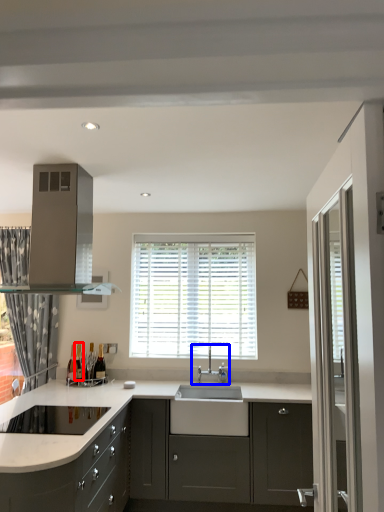
Question: Which object appears closest to the camera in this image, wine bottle (highlighted by a red box) or tap (highlighted by a blue box)?

Choices:
 (A) wine bottle
 (B) tap

Answer: (B)